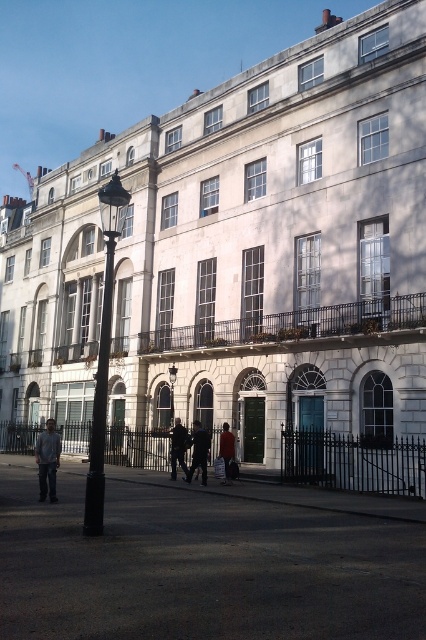
The image size is (426, 640). Identify the location of black metal streetlight at left. (x=103, y=353).

Who is positioned more to the right, black metal streetlight at left or black glass lamp post at center?

black glass lamp post at center is more to the right.

Is point (108, 358) closer to camera compared to point (170, 388)?

Yes, point (108, 358) is closer to viewer.

I want to click on black metal streetlight at left, so click(103, 353).

Who is taller, dark gray jacket at center or red fabric bag at center?

With more height is dark gray jacket at center.

Where is `dark gray jacket at center`? dark gray jacket at center is located at coordinates (178, 448).

Which is behind, point (394, 544) or point (57, 460)?

The point (57, 460) is behind.

Is dark asphalt pavement at lower center wider than denim jacket at lower left?

Correct, the width of dark asphalt pavement at lower center exceeds that of denim jacket at lower left.

Find the location of `dark asphalt pavement at lower center`. dark asphalt pavement at lower center is located at coordinates (201, 566).